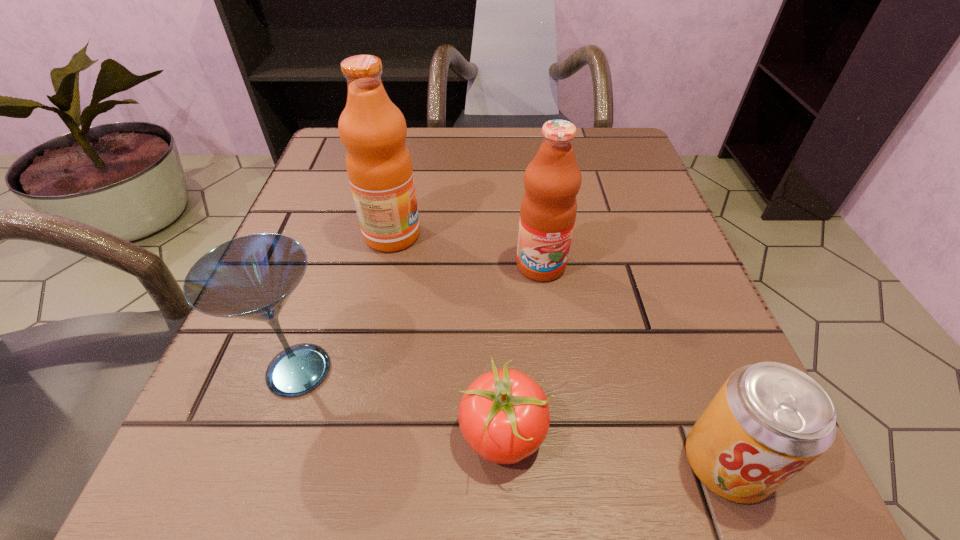
This screenshot has height=540, width=960. What are the coordinates of `free space located on the back of the third tallest object` in the screenshot? It's located at (343, 235).

Identify the location of free space located on the left of the rightmost object. (389, 462).

Image resolution: width=960 pixels, height=540 pixels. I want to click on vacant space situated on the back of the tomato, so pos(495,232).

Where is `pop (soda) situated at the near edge`? pop (soda) situated at the near edge is located at coordinates (769, 420).

Where is `tomato positioned at the near edge`? The height and width of the screenshot is (540, 960). tomato positioned at the near edge is located at coordinates (504, 416).

The image size is (960, 540). What are the coordinates of `fruit juice present at the left edge` in the screenshot? It's located at (373, 130).

The height and width of the screenshot is (540, 960). Identify the location of martini located at the left edge. (251, 277).

You are a GUI agent. You are given a task and a screenshot of the screen. Output one action in this format:
    pyautogui.click(x=<x>, y=<y>)
    Task: Click on the object that is at the right edge
    
    Given the screenshot: What is the action you would take?
    pyautogui.click(x=769, y=420)

Find the location of a particular element. The width and height of the screenshot is (960, 540). object present at the near right corner is located at coordinates (769, 420).

Identify the location of blank area at the far edge. The height and width of the screenshot is (540, 960). (415, 152).